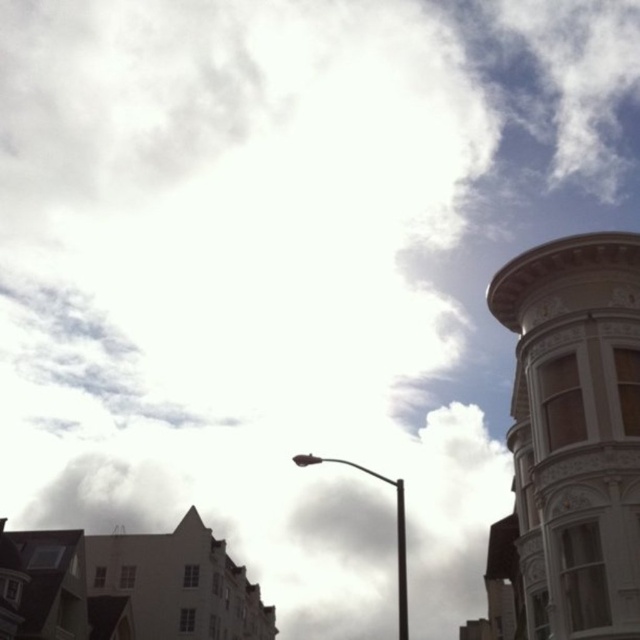
You are standing at the base of the streetlamp in the image. Looking upward, you notice a point marked at coordinates (396, 529). What does this point indicate?

The point at (396, 529) marks the location of the metallic pole at center.

You are standing at the center of the image. Looking at the metallic pole at center, can you tell me its exact 2D coordinates in the image?

The metallic pole at center is located at the 2D coordinates of point (396, 529).

You are a city planner analyzing the urban layout. You observe the metallic pole at center and the black metal pole at center in the image. Which pole has a greater width?

The metallic pole at center has a greater width than the black metal pole at center according to the description.